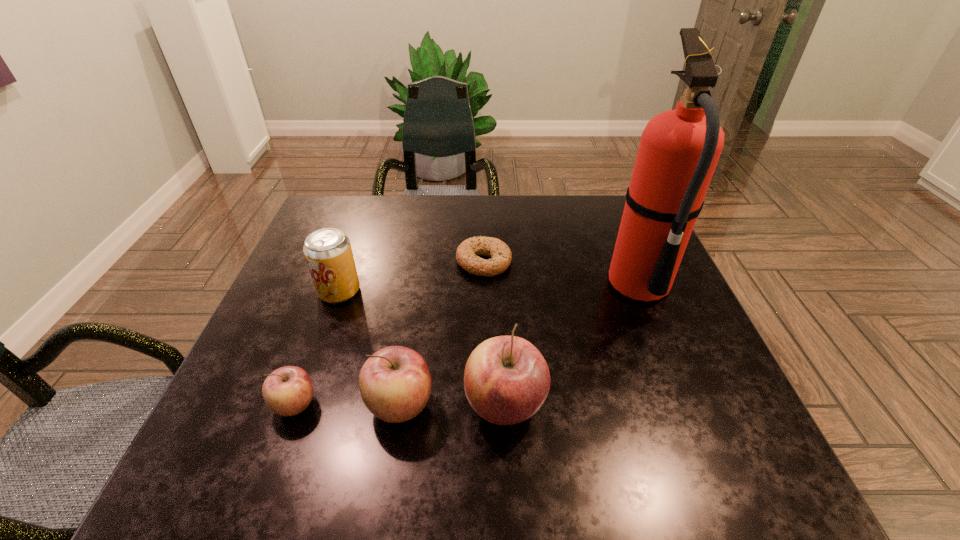
Find the location of a particular element. free location that satisfies the following two spatial constraints: 1. on the back side of the bagel; 2. on the right side of the pop (soda) is located at coordinates (349, 262).

The height and width of the screenshot is (540, 960). I want to click on free space that satisfies the following two spatial constraints: 1. at the nozzle of the rightmost object; 2. on the front side of the rightmost apple, so click(687, 405).

At what (x,y) coordinates should I click in order to perform the action: click on free space that satisfies the following two spatial constraints: 1. at the nozzle of the fire extinguisher; 2. on the front side of the fifth tallest object. Please return your answer as a coordinate pair (x, y). This screenshot has width=960, height=540. Looking at the image, I should click on (687, 404).

At what (x,y) coordinates should I click in order to perform the action: click on vacant space that satisfies the following two spatial constraints: 1. on the back side of the second shortest apple; 2. on the right side of the shortest object. Please return your answer as a coordinate pair (x, y). This screenshot has width=960, height=540. Looking at the image, I should click on (422, 262).

The width and height of the screenshot is (960, 540). In order to click on vacant space that satisfies the following two spatial constraints: 1. on the back side of the bagel; 2. on the right side of the second shortest object in this screenshot , I will do `click(347, 262)`.